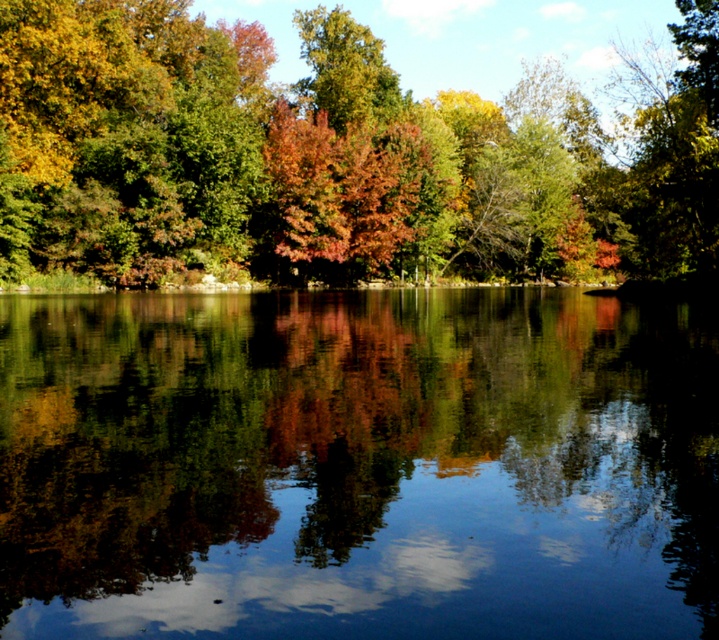
Is transparent glass water at center bigger than autumn leaves at center?

Incorrect, transparent glass water at center is not larger than autumn leaves at center.

Which of these two, transparent glass water at center or autumn leaves at center, stands shorter?

transparent glass water at center

Which is in front, point (175, 451) or point (383, 163)?

Point (175, 451)

In order to click on transparent glass water at center in this screenshot , I will do `click(357, 465)`.

Does autumn leaves at center have a lesser width compared to shiny red leaves at center?

No, autumn leaves at center is not thinner than shiny red leaves at center.

Can you confirm if autumn leaves at center is positioned to the left of shiny red leaves at center?

In fact, autumn leaves at center is to the right of shiny red leaves at center.

Identify the location of autumn leaves at center. This screenshot has width=719, height=640. (334, 156).

Find the location of a particular element. The image size is (719, 640). autumn leaves at center is located at coordinates click(334, 156).

Which is above, transparent glass water at center or shiny red leaves at center?

Positioned higher is shiny red leaves at center.

Can you confirm if transparent glass water at center is smaller than shiny red leaves at center?

Indeed, transparent glass water at center has a smaller size compared to shiny red leaves at center.

Is point (313, 556) positioned in front of point (393, 172)?

That is True.

The width and height of the screenshot is (719, 640). In order to click on transparent glass water at center in this screenshot , I will do `click(357, 465)`.